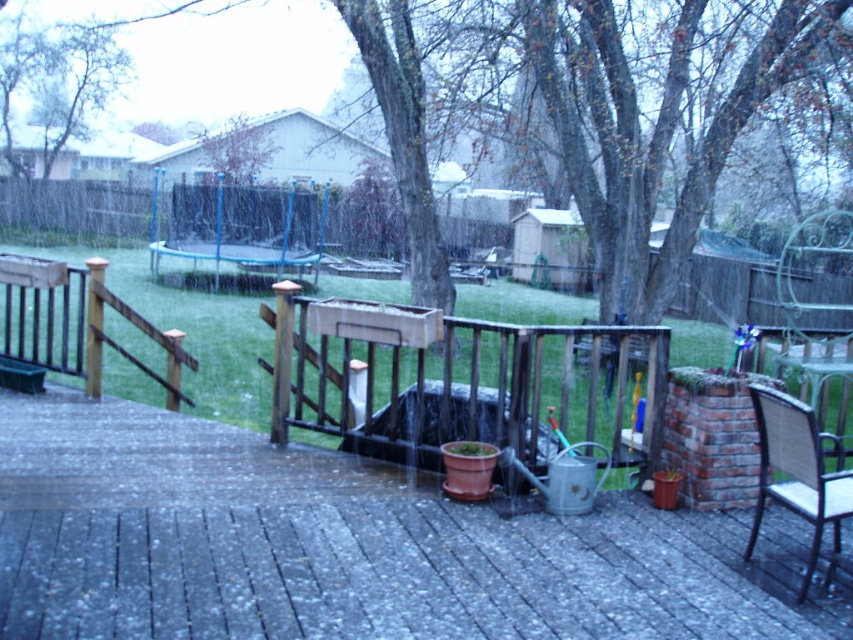
You are planning to host a small gathering on the deck. Given the size of the smooth concrete deck at center and the woven wicker chair at lower right, will the chair fit comfortably on the deck without overcrowding it?

The smooth concrete deck at center is bigger than the woven wicker chair at lower right, so the chair will fit comfortably on the deck without overcrowding it.

You are standing on the wooden deck in the backyard during the light rain. You notice two points marked in the scene. The first point is at coordinate point(178,456) and the second at point(782,493). From your current position on the deck, which point is closer to you?

Point(782,493) is closer to you because it is in front of point(178,456) according to the scene description.